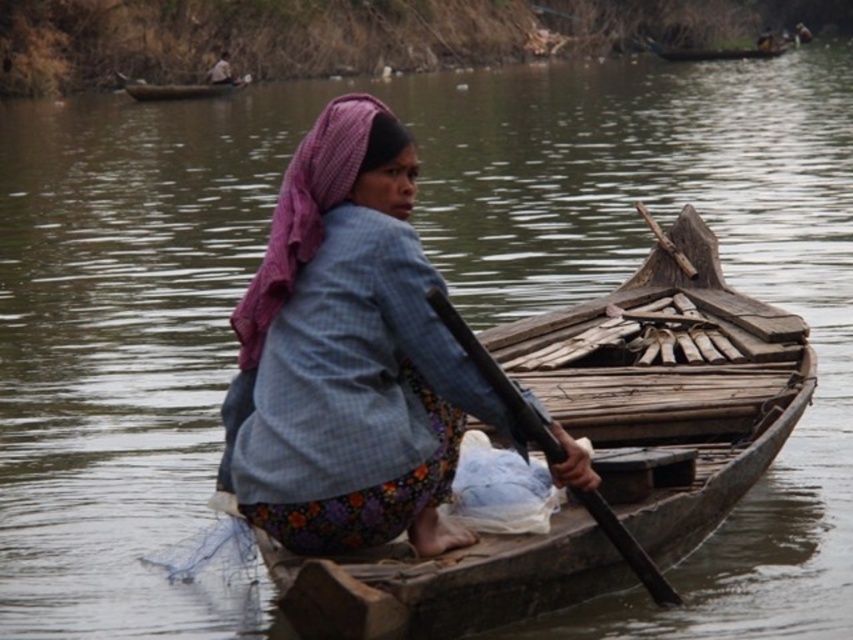
You are standing on the dock and see the wooden boat at center and the blue plaid shirt at center in the image. Which object is closer to the water surface?

The wooden boat at center is positioned under the blue plaid shirt at center, so the wooden boat at center is closer to the water surface.